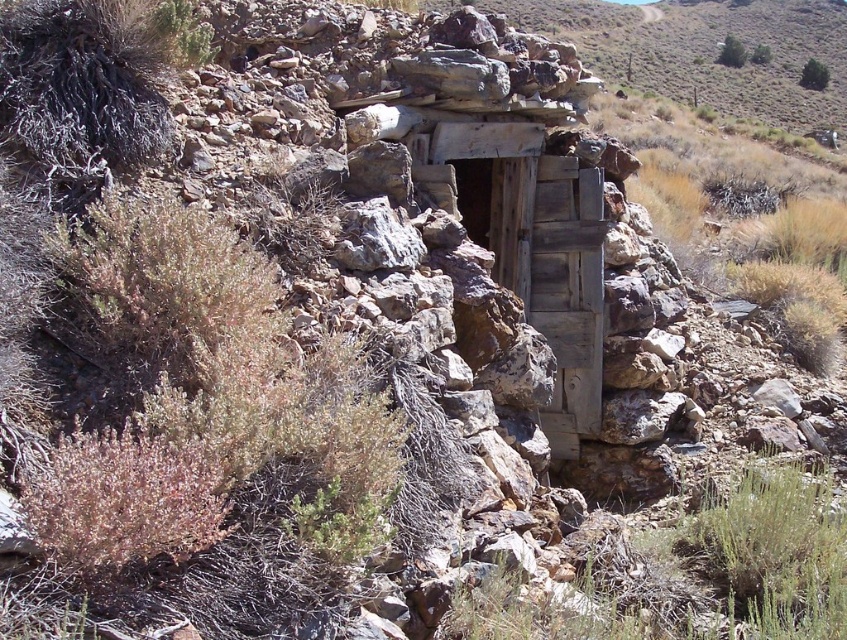
You are standing outside the abandoned structure and notice two plants nearby. The green leafy bush at upper right and the green leafy shrub at upper center. Which one is closer to the entrance of the structure?

The green leafy shrub at upper center is closer to the entrance of the structure because it is positioned above the green leafy bush at upper right, which is located underneath it.

You are a hiker who wants to take a photo of the green leafy shrub at upper right and the green leafy shrub at upper center from the entrance of the abandoned structure. Can you fit both shrubs in the frame of your camera which has a maximum horizontal field of view of 3 meters?

The green leafy shrub at upper right and green leafy shrub at upper center are 3.23 meters apart. Since the distance between them exceeds the camera field of view of 3 meters, you cannot fit both shrubs in the frame.

You are a hiker who wants to take a photo of both green leafy shrub at upper right and green leafy shrub at upper center. Which shrub should you move closer to in order to capture both in the same frame?

You should move closer to the green leafy shrub at upper center because it is smaller than the green leafy shrub at upper right, allowing both to fit within the frame when positioned closer to the smaller one.